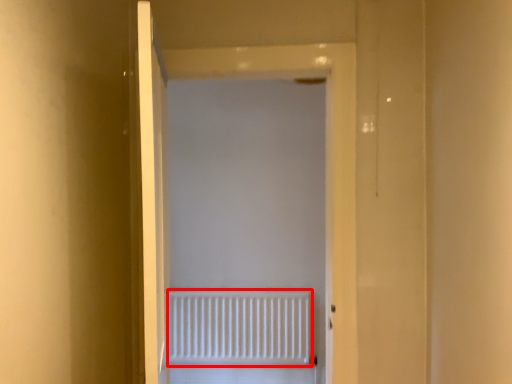
Question: From the image's perspective, considering the relative positions of radiator (annotated by the red box) and door in the image provided, where is radiator (annotated by the red box) located with respect to the staircase?

Choices:
 (A) below
 (B) above

Answer: (A)